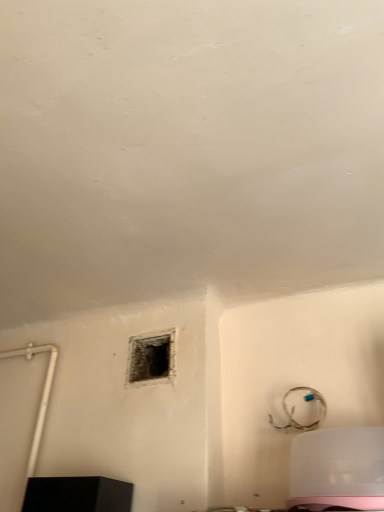
The image size is (384, 512). Find the location of `dark gray concrete vent at center`. dark gray concrete vent at center is located at coordinates (151, 358).

Measure the distance between point (131, 351) and camera.

Point (131, 351) and camera are 4.58 feet apart.

This screenshot has height=512, width=384. Describe the element at coordinates (151, 358) in the screenshot. I see `dark gray concrete vent at center` at that location.

This screenshot has width=384, height=512. I want to click on dark gray concrete vent at center, so click(151, 358).